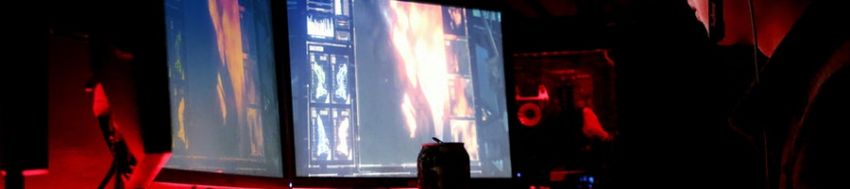
Find the location of `speaker`. speaker is located at coordinates (564, 93).